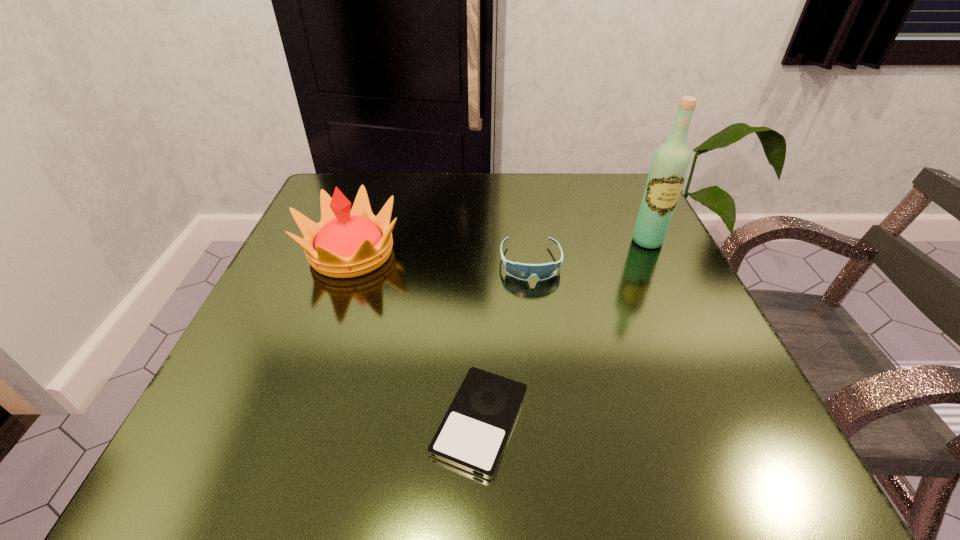
The width and height of the screenshot is (960, 540). I want to click on vacant space at the far right corner, so pos(585,217).

Where is `vacant space at the near right corner of the desktop`? This screenshot has height=540, width=960. vacant space at the near right corner of the desktop is located at coordinates (703, 429).

Find the location of a particular element. empty space that is in between the leftmost object and the third tallest object is located at coordinates (441, 258).

At what (x,y) coordinates should I click in order to perform the action: click on vacant area that lies between the rightmost object and the nearest object. Please return your answer as a coordinate pair (x, y). Looking at the image, I should click on (564, 331).

Locate an element on the screen. Image resolution: width=960 pixels, height=540 pixels. free space between the iPod and the leftmost object is located at coordinates (416, 337).

The width and height of the screenshot is (960, 540). What are the coordinates of `blank region between the leftmost object and the goggles` in the screenshot? It's located at (441, 258).

At what (x,y) coordinates should I click in order to perform the action: click on blank region between the leftmost object and the shortest object. Please return your answer as a coordinate pair (x, y). Image resolution: width=960 pixels, height=540 pixels. Looking at the image, I should click on (416, 337).

Find the location of a particular element. This screenshot has width=960, height=540. free space between the goggles and the rightmost object is located at coordinates (588, 252).

Where is `free area in between the rightmost object and the goggles`? This screenshot has width=960, height=540. free area in between the rightmost object and the goggles is located at coordinates (588, 252).

This screenshot has width=960, height=540. I want to click on vacant space in between the goggles and the shortest object, so click(x=505, y=342).